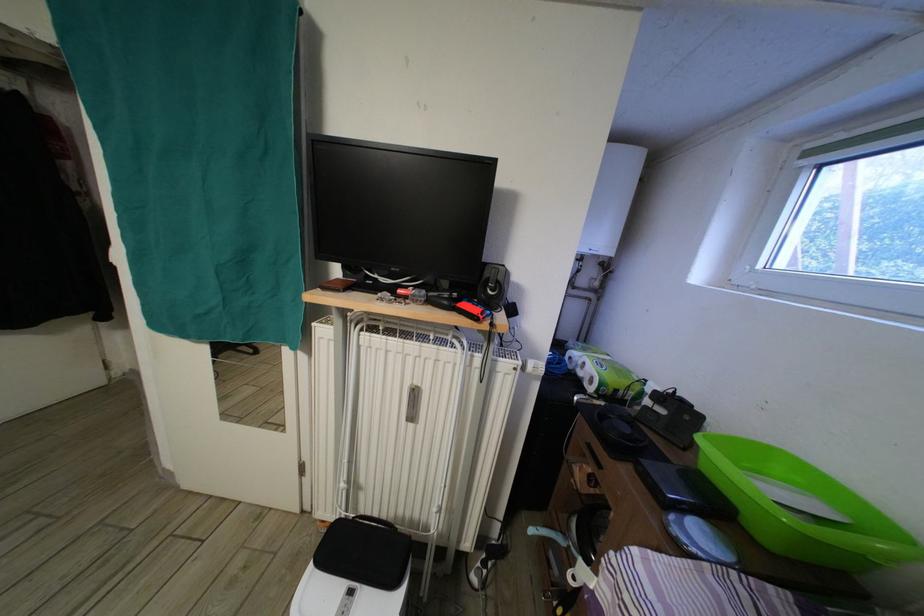
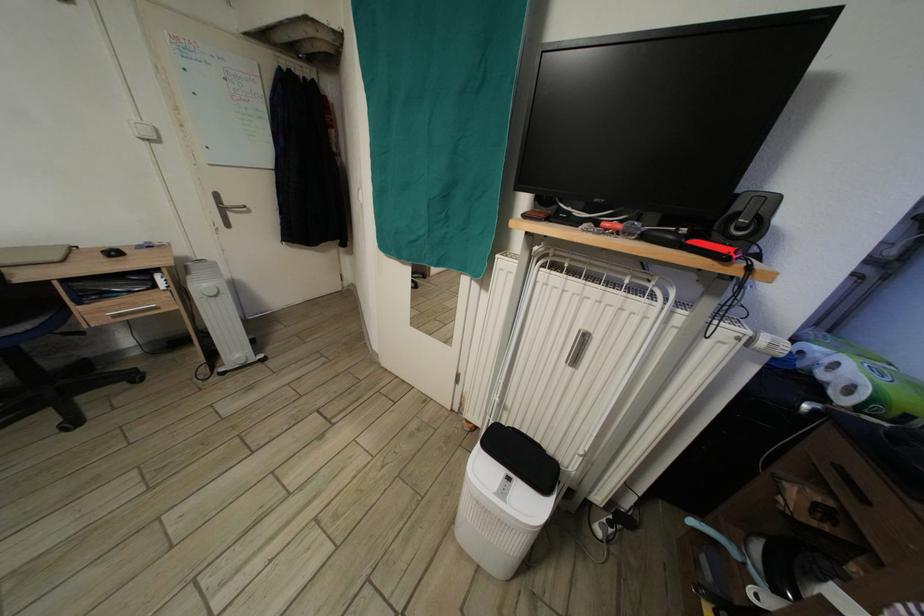
Question: How did the camera likely rotate?

Choices:
 (A) Left
 (B) Right
 (C) Up
 (D) Down

Answer: (A)